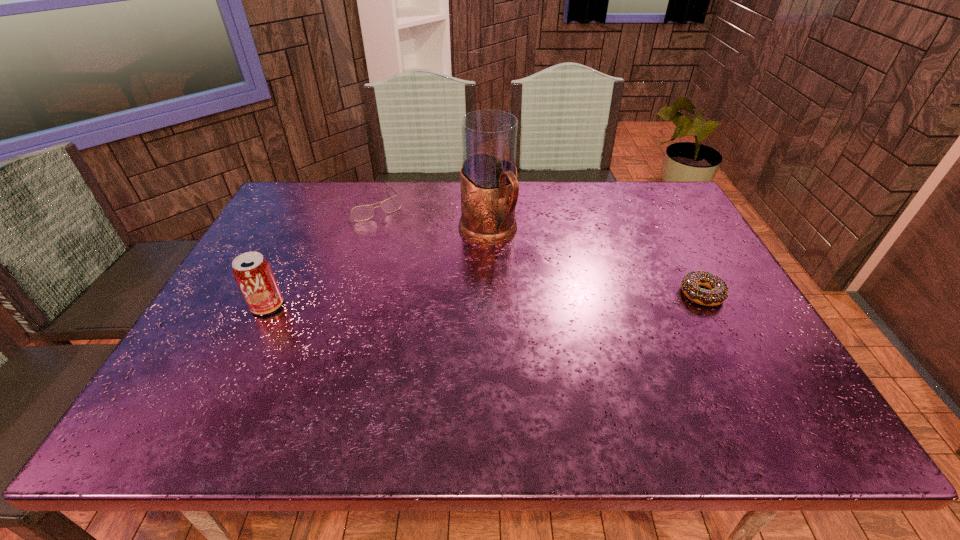
Locate an element on the screen. The image size is (960, 540). free space at the far edge is located at coordinates (588, 181).

Locate an element on the screen. The height and width of the screenshot is (540, 960). vacant space at the near edge of the desktop is located at coordinates (459, 369).

Where is `vacant area at the right edge of the desktop`? vacant area at the right edge of the desktop is located at coordinates (736, 300).

Where is `free space at the far left corner of the desktop`? The image size is (960, 540). free space at the far left corner of the desktop is located at coordinates (283, 206).

Where is `vacant space at the near right corner`? vacant space at the near right corner is located at coordinates (741, 370).

What are the coordinates of `vacant space in between the second tallest object and the third object from left to right` in the screenshot? It's located at pos(377,269).

Identify the location of unoccupied position between the rightmost object and the spectacles. (536, 249).

Locate an element on the screen. The image size is (960, 540). unoccupied position between the shortest object and the leftmost object is located at coordinates (485, 300).

At what (x,y) coordinates should I click in order to perform the action: click on vacant region between the rightmost object and the pitcher. Please return your answer as a coordinate pair (x, y). Looking at the image, I should click on [595, 263].

Find the location of `empty space that is in between the second tallest object and the spectacles`. empty space that is in between the second tallest object and the spectacles is located at coordinates (319, 255).